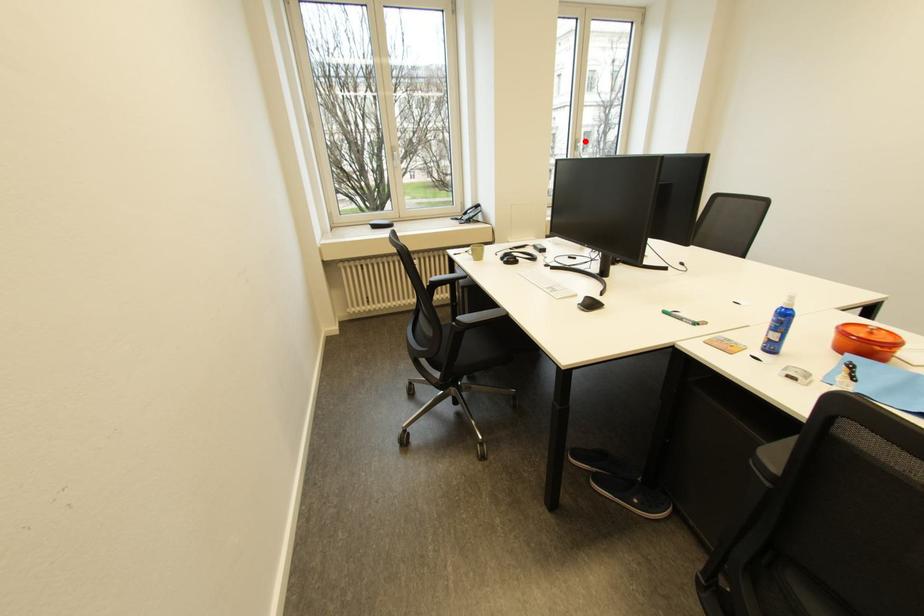
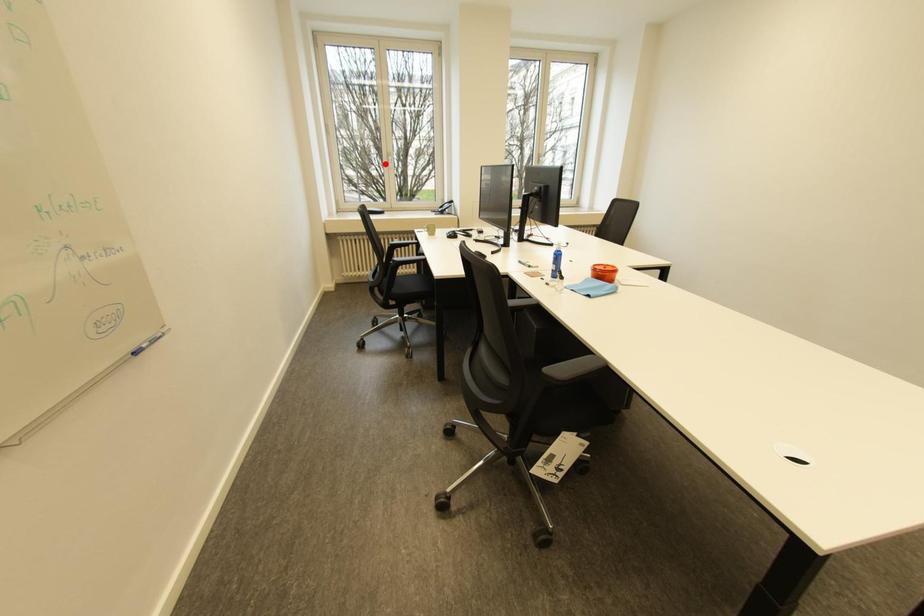
I am providing you with two images of the same scene from different viewpoints. A red point is marked on the first image and another point is marked on the second image. Does the point marked in image1 correspond to the same location as the one in image2?

No